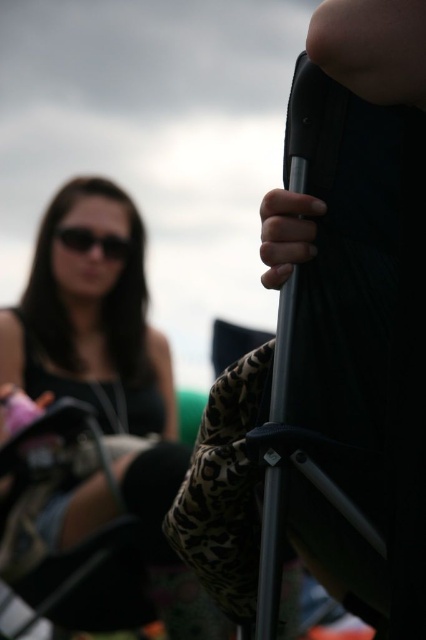
Which is more to the right, matte black tank top at left or black matte sunglasses at upper left?

From the viewer's perspective, matte black tank top at left appears more on the right side.

Measure the distance between point (98, 486) and camera.

Point (98, 486) and camera are 2.04 meters apart from each other.

Is point (160, 355) closer to camera compared to point (65, 243)?

No, it is not.

Where is `matte black tank top at left`? The width and height of the screenshot is (426, 640). matte black tank top at left is located at coordinates (94, 413).